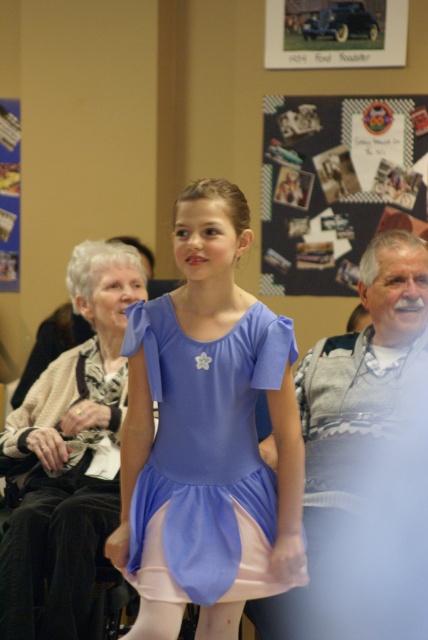
Question: Can you confirm if matte white sweater at upper left is positioned to the left of pink satin tights at lower left?

Choices:
 (A) yes
 (B) no

Answer: (A)

Question: Estimate the real-world distances between objects in this image. Which object is closer to the dark blue fabric bulletin board at upper center?

Choices:
 (A) pink satin tights at lower left
 (B) matte white sweater at upper left

Answer: (B)

Question: Which object is closer to the camera taking this photo?

Choices:
 (A) metallic silver car at upper center
 (B) matte white sweater at upper left

Answer: (B)

Question: Where is matte white sweater at upper left located in relation to pink satin tights at lower left in the image?

Choices:
 (A) left
 (B) right

Answer: (A)

Question: Which point is closer to the camera?

Choices:
 (A) pink satin tights at lower left
 (B) matte purple fabric dress at center
 (C) metallic silver car at upper center

Answer: (B)

Question: Is matte purple fabric dress at center above metallic silver car at upper center?

Choices:
 (A) no
 (B) yes

Answer: (A)